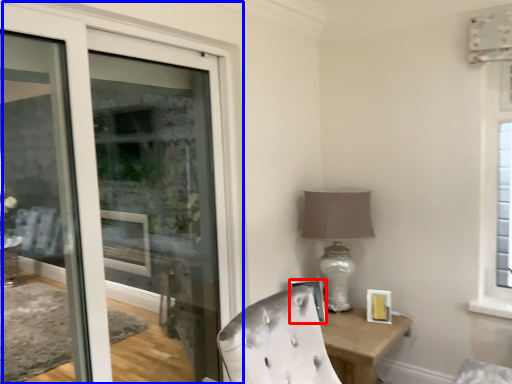
Question: Among these objects, which one is nearest to the camera, picture frame (highlighted by a red box) or door (highlighted by a blue box)?

Choices:
 (A) picture frame
 (B) door

Answer: (B)